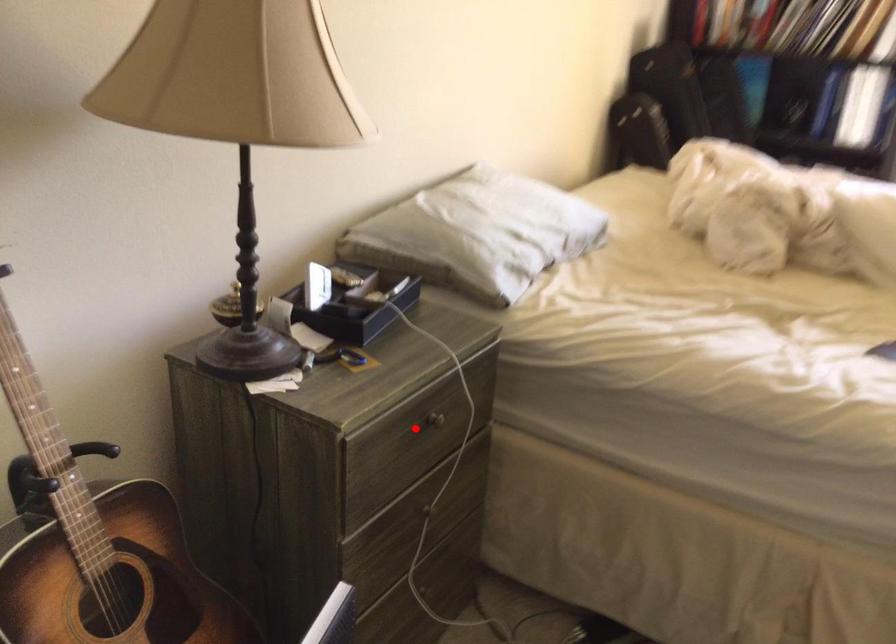
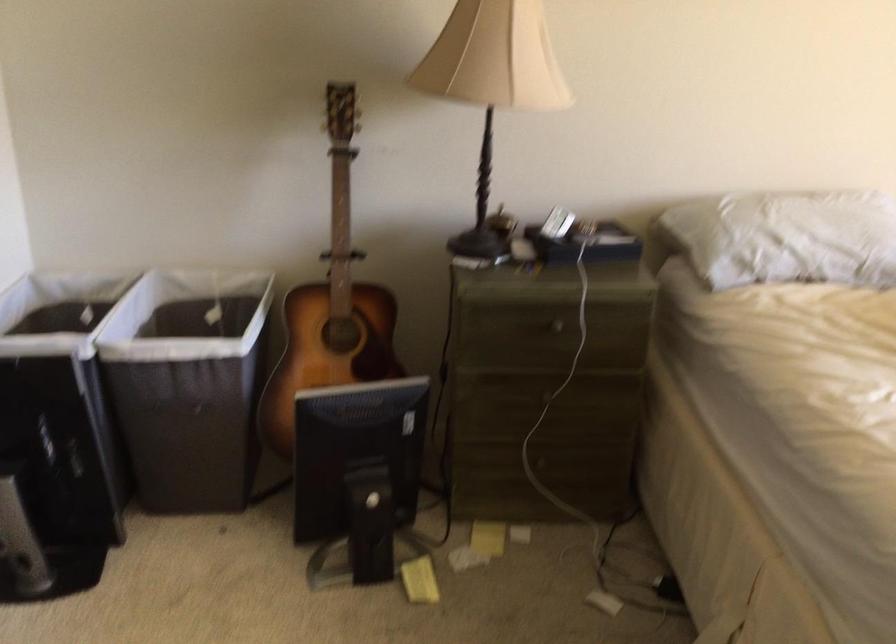
Question: I am providing you with two images of the same scene from different viewpoints. A red point is shown in image1. For the corresponding object point in image2, is it positioned nearer or farther from the camera?

Choices:
 (A) Nearer
 (B) Farther

Answer: (B)